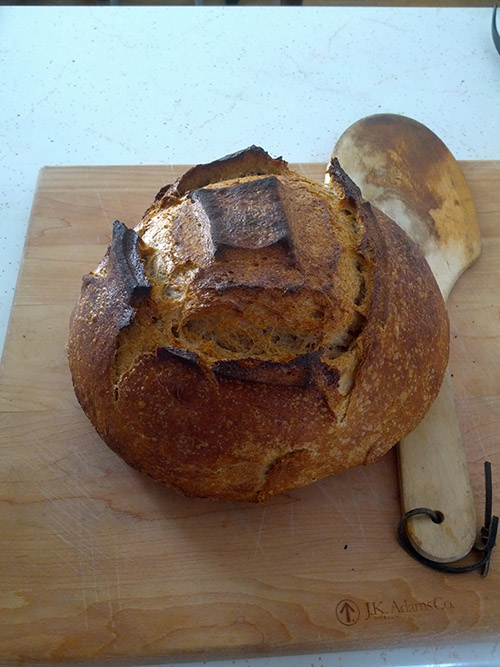
Identify the location of spoon. The width and height of the screenshot is (500, 667). (446, 487).